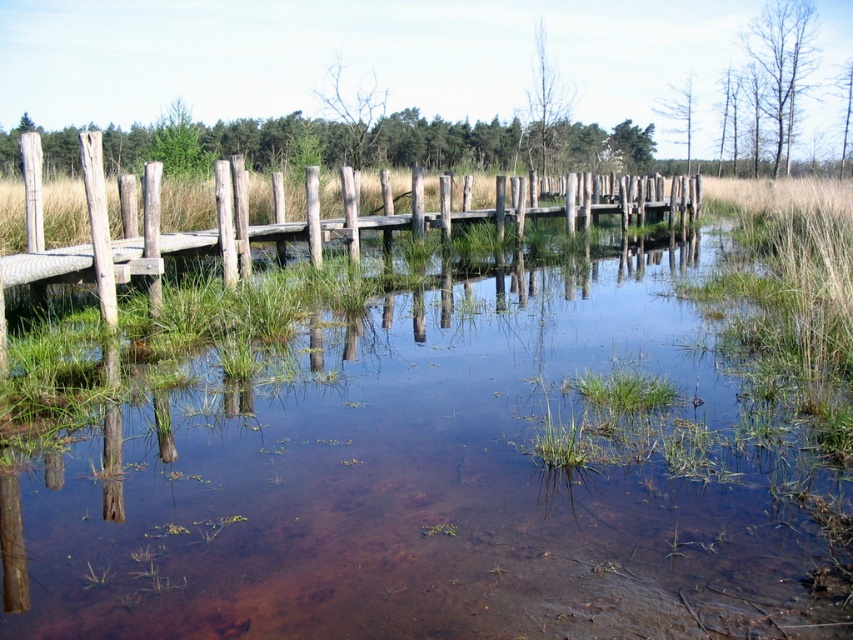
You are standing on the wooden planks at center and want to step onto the clear water at center. Considering their widths, is this possible?

The clear water at center has a lesser width compared to wooden planks at center, so stepping from the wooden planks at center to the clear water at center may be difficult due to the narrower space of the water.

You are a maintenance worker checking the boardwalk. You need to determine if the clear water at center can reach the top of the wooden planks at center. Based on the scene, what do you observe?

The clear water at center is not as tall as wooden planks at center, so the water cannot reach the top of the wooden planks at center.